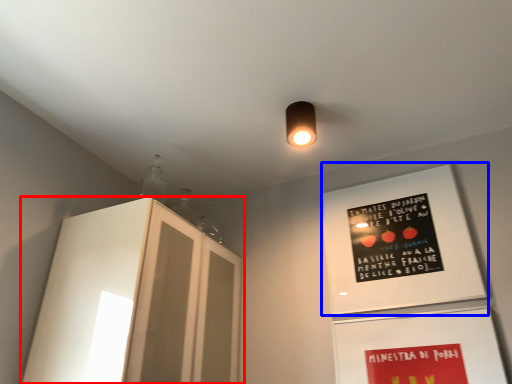
Question: Which object is closer to the camera taking this photo, cabinetry (highlighted by a red box) or bulletin board (highlighted by a blue box)?

Choices:
 (A) cabinetry
 (B) bulletin board

Answer: (A)